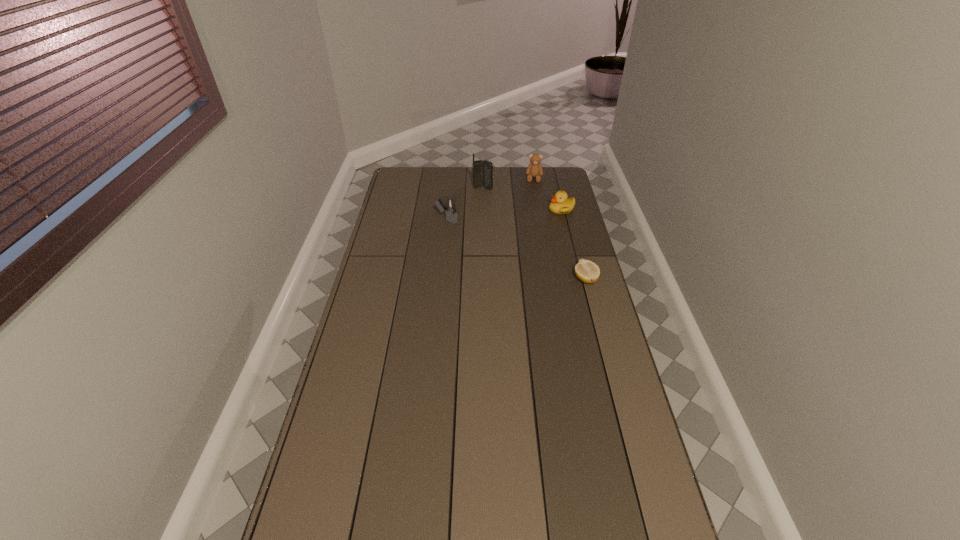
This screenshot has width=960, height=540. I want to click on free space located 0.110m on the keyboard of the cellular telephone, so pyautogui.click(x=492, y=202).

You are a GUI agent. You are given a task and a screenshot of the screen. Output one action in this format:
    pyautogui.click(x=<x>, y=<y>)
    Task: Click on the vacant space located 0.280m on the keyboard of the cellular telephone
    
    Given the screenshot: What is the action you would take?
    pyautogui.click(x=505, y=221)

You are a GUI agent. You are given a task and a screenshot of the screen. Output one action in this format:
    pyautogui.click(x=<x>, y=<y>)
    Task: Click on the vacant space situated on the front-facing side of the fourth tallest object
    This screenshot has width=960, height=540.
    Given the screenshot: What is the action you would take?
    pyautogui.click(x=490, y=247)

Identify the location of vacant space located 0.200m on the front-facing side of the fourth tallest object. (521, 230).

This screenshot has width=960, height=540. In order to click on blank area located 0.380m on the front-facing side of the fourth tallest object in this screenshot , I will do `click(492, 246)`.

I want to click on free space located 0.400m on the front-facing side of the farthest object, so click(530, 228).

Image resolution: width=960 pixels, height=540 pixels. I want to click on vacant space located 0.110m on the front-facing side of the farthest object, so click(x=533, y=194).

I want to click on vacant space located 0.300m on the front-facing side of the farthest object, so [x=531, y=215].

This screenshot has width=960, height=540. I want to click on cellular telephone that is positioned at the far edge, so click(482, 170).

This screenshot has height=540, width=960. I want to click on teddy bear at the far edge, so click(534, 169).